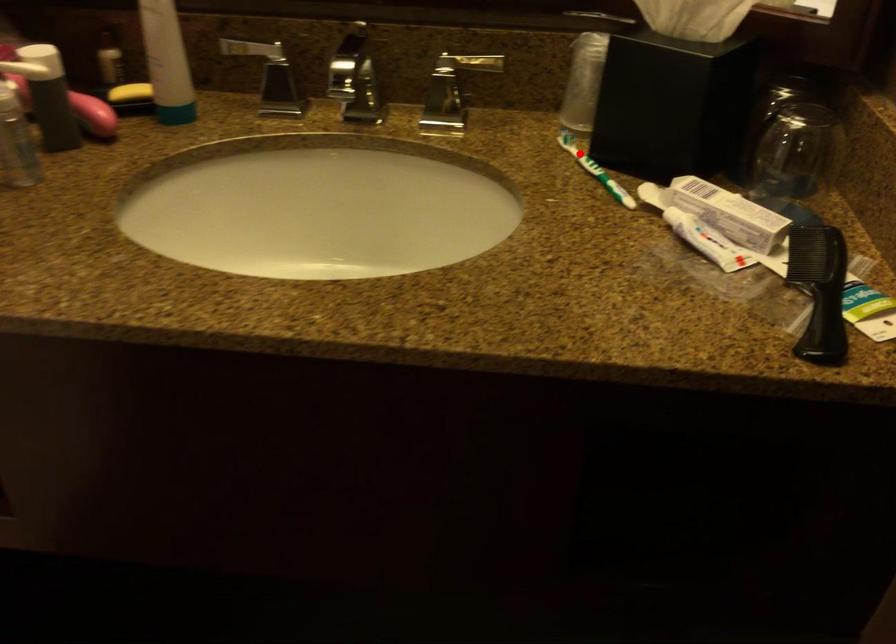
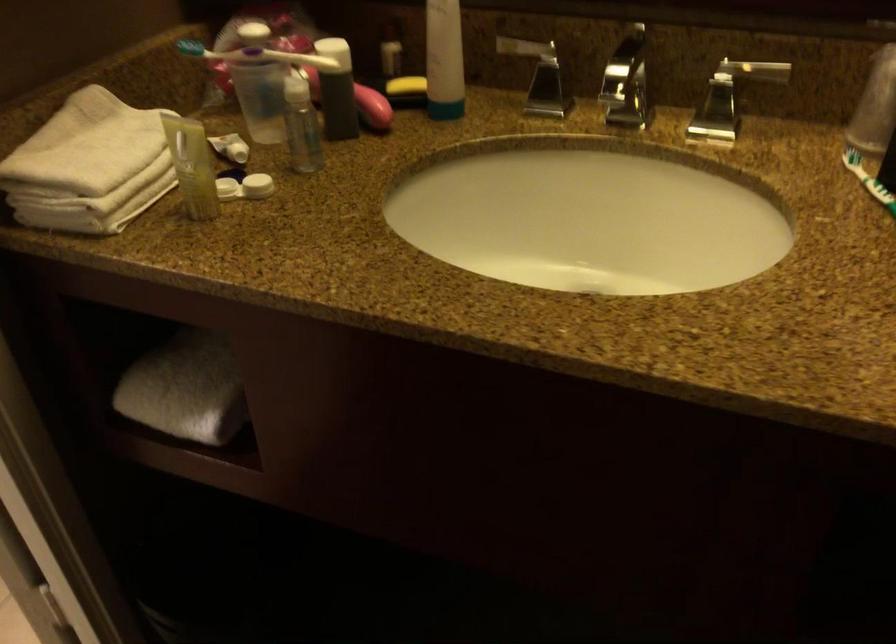
In the second image, find the point that corresponds to the highlighted location in the first image.

(867, 180)